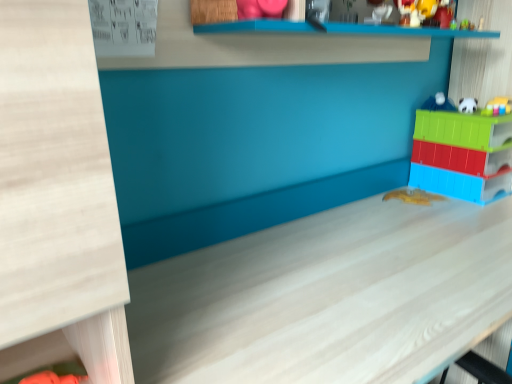
Question: Visually, is white glossy ball at upper right, which ranks as the 5th toy in bottom-to-top order, positioned to the left or to the right of white matte table at center?

Choices:
 (A) left
 (B) right

Answer: (B)

Question: In terms of height, does white glossy ball at upper right, which ranks as the first toy in top-to-bottom order, look taller or shorter compared to white matte table at center?

Choices:
 (A) tall
 (B) short

Answer: (B)

Question: Which of these objects is positioned farthest from the white glossy ball at upper right, which ranks as the 5th toy in bottom-to-top order?

Choices:
 (A) yellow plastic toy at center, arranged as the fifth toy when viewed from the top
 (B) translucent plastic toy at right, the second toy from the bottom
 (C) white matte table at center
 (D) white plush toy at upper right, which appears as the 2th toy when viewed from the top
 (E) green plastic toy at upper right, the 3th toy positioned from the top

Answer: (C)

Question: Estimate the real-world distances between objects in this image. Which object is farther from the white glossy ball at upper right, which ranks as the first toy in top-to-bottom order?

Choices:
 (A) white matte table at center
 (B) yellow plastic toy at center, arranged as the fifth toy when viewed from the top
 (C) green plastic toy at upper right, positioned as the third toy in bottom-to-top order
 (D) translucent plastic toy at right, which ranks as the 4th toy in top-to-bottom order
 (E) white plush toy at upper right, which appears as the 2th toy when viewed from the top

Answer: (A)